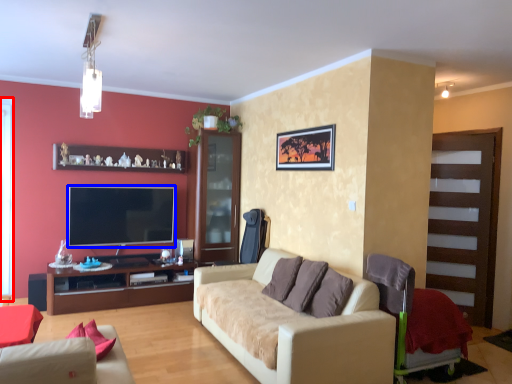
Question: Among these objects, which one is farthest to the camera, window screen (highlighted by a red box) or television (highlighted by a blue box)?

Choices:
 (A) window screen
 (B) television

Answer: (B)